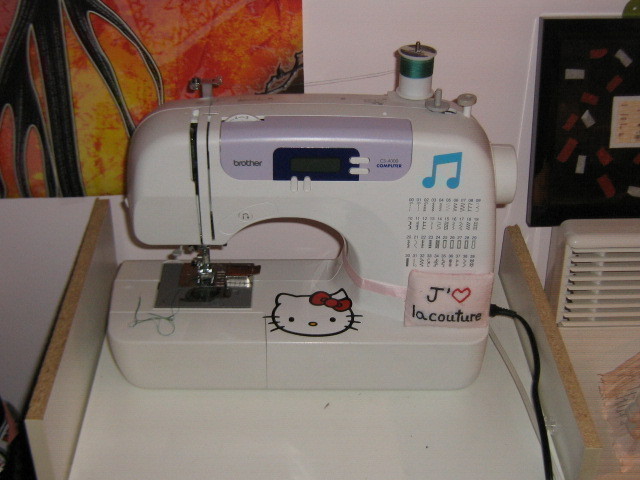
Where is `hello kitty sticker`? The height and width of the screenshot is (480, 640). hello kitty sticker is located at coordinates [308, 312].